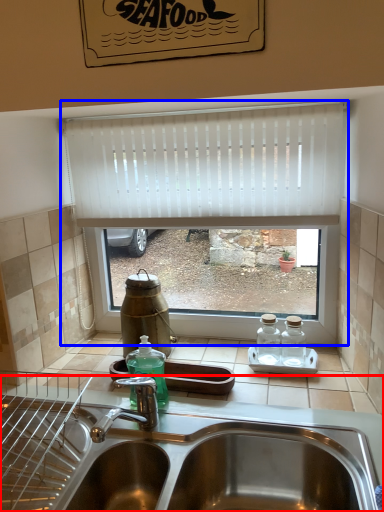
Question: Among these objects, which one is farthest to the camera, sink (highlighted by a red box) or window (highlighted by a blue box)?

Choices:
 (A) sink
 (B) window

Answer: (B)